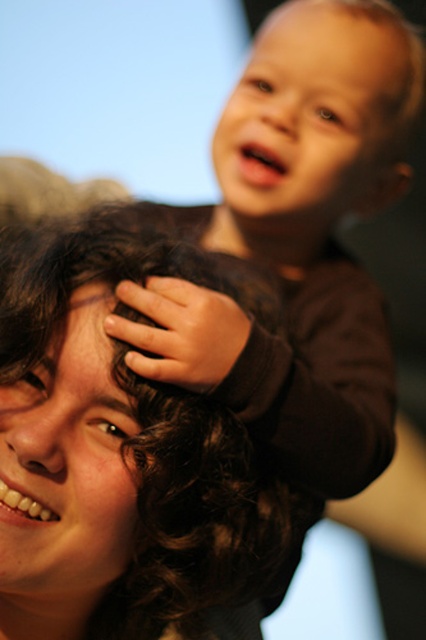
You are a photographer adjusting the lighting in the scene. You notice the dark curly hair at center and the smooth brown hair at upper right. Which hair should you adjust the light to highlight first if you want to ensure both are visible in the photo?

The dark curly hair at center should be highlighted first because it is positioned under the smooth brown hair at upper right, so adjusting the light for the lower hair will help ensure both are visible without one overshadowing the other.

Based on the scene description, can you determine if the dark curly hair at center is wider than the smooth brown hair at upper right?

The dark curly hair at center is wider than the smooth brown hair at upper right according to the description.

In the image, you see two people interacting. The adult has dark curly hair at center, and the child has smooth brown hair at upper right. Which of their hair is bigger in size?

The dark curly hair at center has a larger size compared to smooth brown hair at upper right.